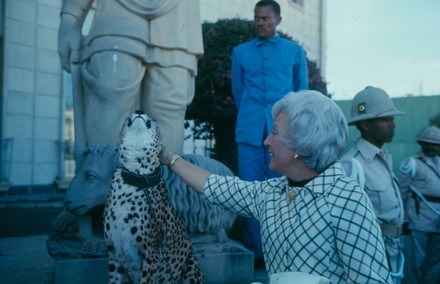
At what (x,y) coordinates should I click in order to perform the action: click on statue. Please return your answer as a coordinate pair (x, y). The height and width of the screenshot is (284, 440). Looking at the image, I should click on (147, 31).